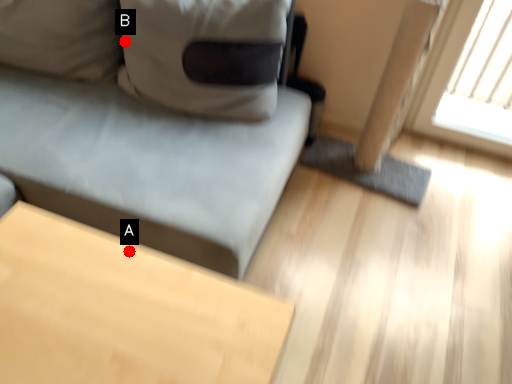
Question: Two points are circled on the image, labeled by A and B beside each circle. Which point is closer to the camera?

Choices:
 (A) A is closer
 (B) B is closer

Answer: (A)